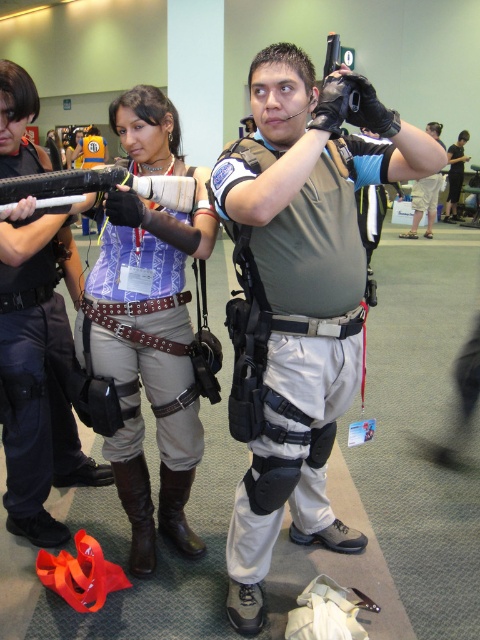
You are a prop designer checking the proportions of the costumes for a new action movie. You need to ensure that the matte black gun at center is proportionally smaller than the black leather gloves at upper center. Does the current design meet this requirement?

Yes, the matte black gun at center is shorter than the black leather gloves at upper center, so it meets the requirement.

You are a photographer at the event and want to take a photo of the matte purple shirt at center without any obstructions. Given that the black matte gun at center is in the scene, where should you position yourself to ensure the gun does not block the view of the shirt?

To avoid the black matte gun at center obstructing the view, position yourself so that you are in front of the matte purple shirt at center, as the gun is located behind it. This way, the shirt will be visible without the gun blocking it.